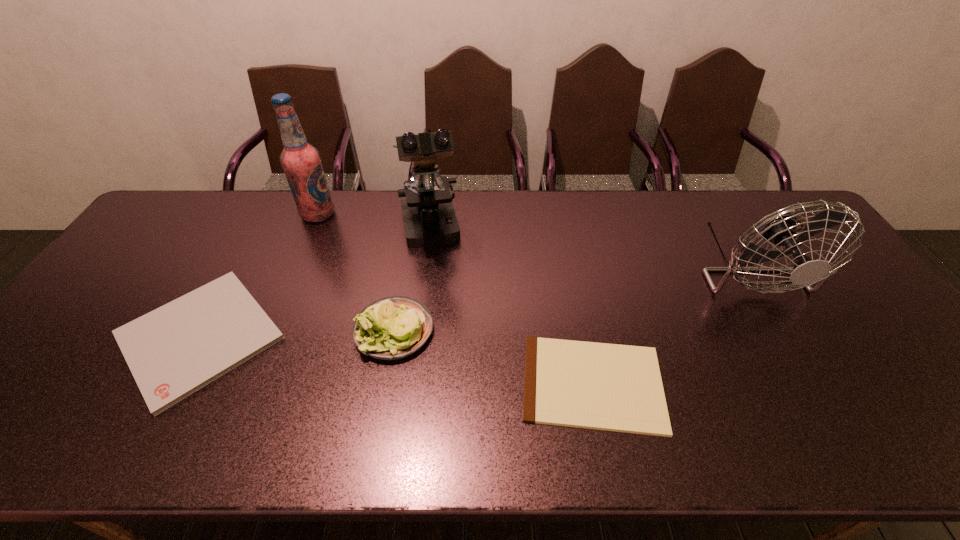
Find the location of a particular element. This screenshot has width=960, height=540. microscope is located at coordinates (429, 218).

Image resolution: width=960 pixels, height=540 pixels. I want to click on alcohol, so click(x=301, y=162).

Locate an element on the screen. The height and width of the screenshot is (540, 960). the rightmost object is located at coordinates (780, 229).

Identify the location of fan. The width and height of the screenshot is (960, 540). (780, 229).

Where is `the fourth tallest object`? Image resolution: width=960 pixels, height=540 pixels. the fourth tallest object is located at coordinates (391, 328).

Locate an element on the screen. This screenshot has height=540, width=960. the left clipboard is located at coordinates (173, 351).

This screenshot has height=540, width=960. I want to click on the second shortest object, so click(x=173, y=351).

The height and width of the screenshot is (540, 960). I want to click on the right clipboard, so click(610, 387).

The height and width of the screenshot is (540, 960). I want to click on the shortest object, so click(x=610, y=387).

The image size is (960, 540). Find the location of `vacant space located 0.300m on the left of the microscope`. vacant space located 0.300m on the left of the microscope is located at coordinates (305, 230).